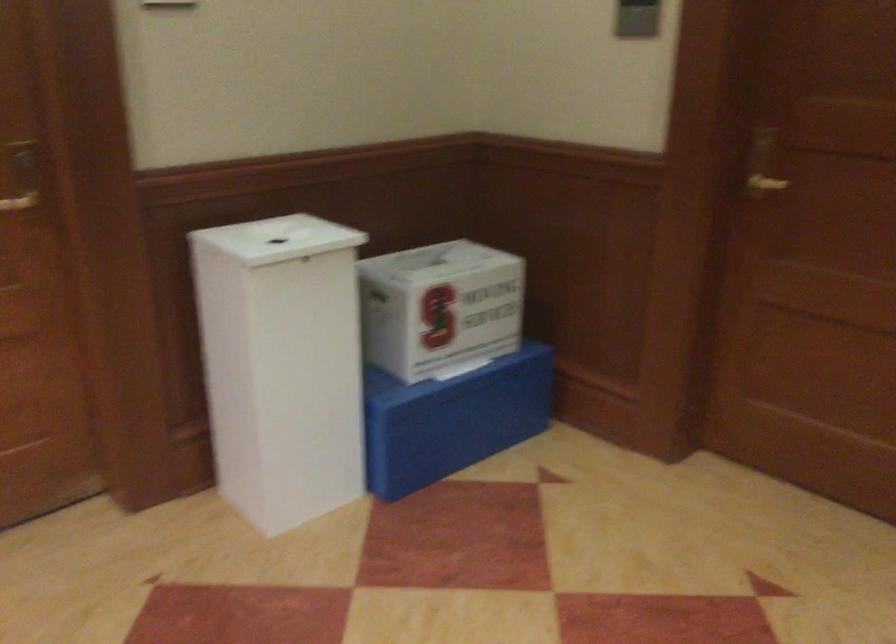
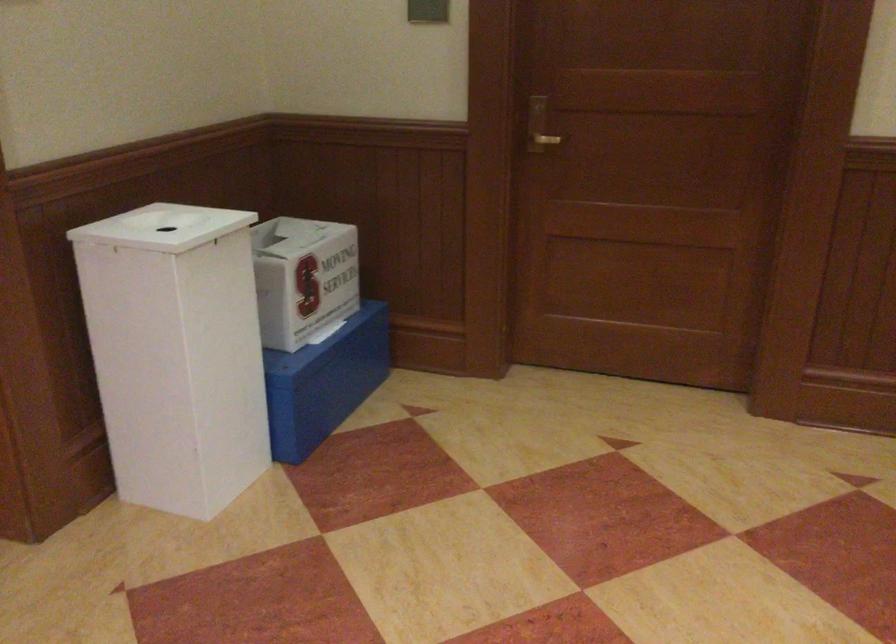
Question: The camera is either moving clockwise (left) or counter-clockwise (right) around the object. The first image is from the beginning of the video and the second image is from the end. Is the camera moving left or right when shooting the video?

Choices:
 (A) Left
 (B) Right

Answer: (A)